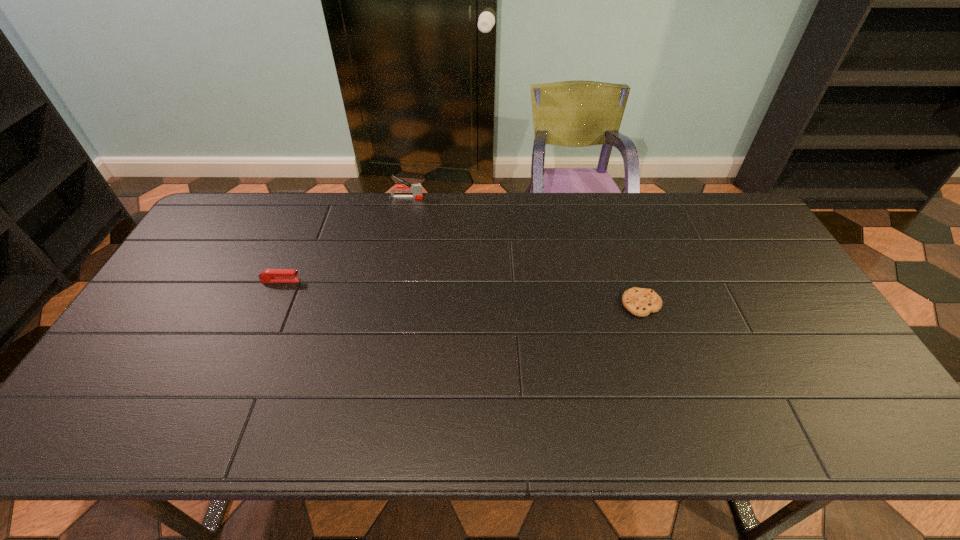
This screenshot has width=960, height=540. What are the coordinates of `the tallest object` in the screenshot? It's located at (416, 188).

Where is `the second object from left to right`? This screenshot has width=960, height=540. the second object from left to right is located at coordinates (416, 188).

The image size is (960, 540). Find the location of `the leftmost object`. the leftmost object is located at coordinates (269, 275).

In order to click on the left stapler in this screenshot , I will do `click(269, 275)`.

Find the location of a particular element. the shortest object is located at coordinates (641, 302).

Image resolution: width=960 pixels, height=540 pixels. I want to click on the rightmost object, so click(x=641, y=302).

The image size is (960, 540). In order to click on vacant space located 0.080m on the handle side of the farthest object in this screenshot , I will do `click(444, 198)`.

Find the location of a particular element. The width and height of the screenshot is (960, 540). vacant space located on the front-facing side of the left stapler is located at coordinates (320, 281).

I want to click on vacant space located 0.100m on the right of the nearest object, so click(696, 305).

Locate an element on the screen. This screenshot has height=540, width=960. object at the far edge is located at coordinates (416, 188).